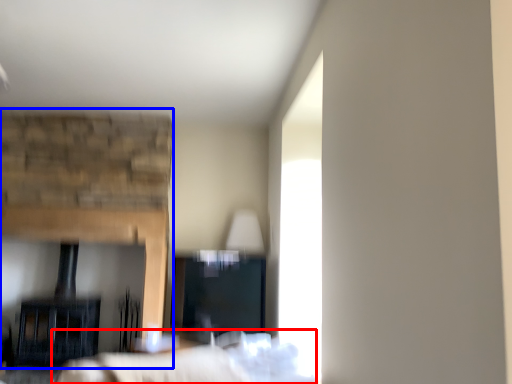
Question: Which of the following is the closest to the observer, bed (highlighted by a red box) or fireplace (highlighted by a blue box)?

Choices:
 (A) bed
 (B) fireplace

Answer: (A)